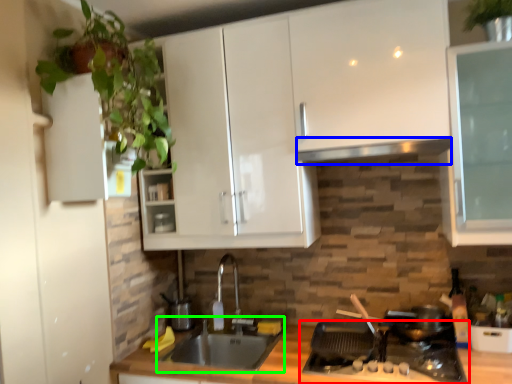
Question: Which is nearer to the gas stove (highlighted by a red box)? exhaust hood (highlighted by a blue box) or sink (highlighted by a green box).

Choices:
 (A) exhaust hood
 (B) sink

Answer: (B)